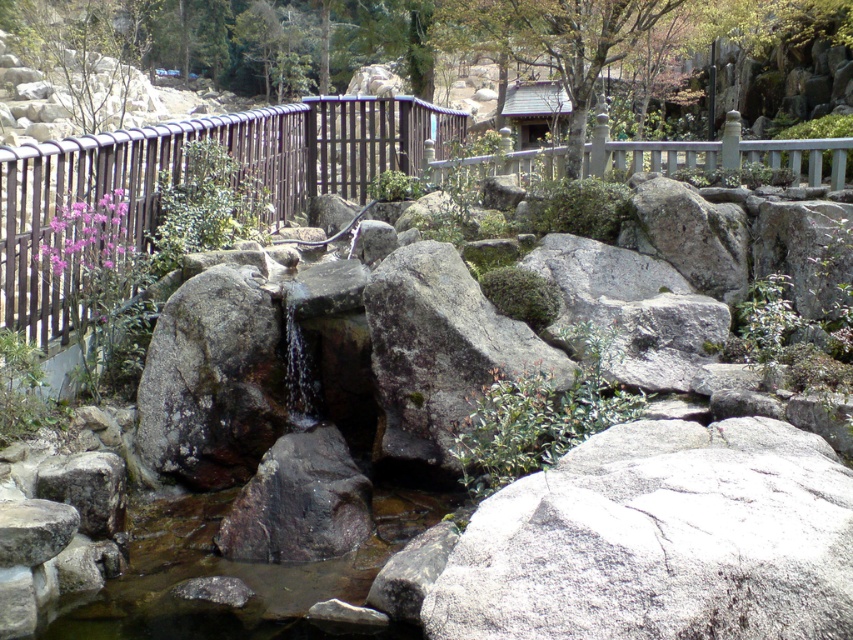
Does gray rough rock at center have a smaller size compared to dark gray rough rock at center?

Actually, gray rough rock at center might be larger than dark gray rough rock at center.

Can you confirm if gray rough rock at center is shorter than dark gray rough rock at center?

Yes.

Who is more distant from viewer, (675, 502) or (350, 516)?

The point (350, 516) is behind.

Where is `gray rough rock at center`? gray rough rock at center is located at coordinates (660, 540).

Who is more distant from viewer, [822,618] or [425,381]?

Point [425,381]

This screenshot has height=640, width=853. I want to click on gray rough rock at center, so click(660, 540).

Is green mossy rock at center closer to the viewer compared to dark gray rough rock at center?

No, green mossy rock at center is behind dark gray rough rock at center.

Who is positioned more to the left, green mossy rock at center or dark gray rough rock at center?

dark gray rough rock at center is more to the left.

Is point (465, 282) positioned in front of point (358, 488)?

No, it is behind (358, 488).

Locate an element on the screen. The width and height of the screenshot is (853, 640). green mossy rock at center is located at coordinates (439, 355).